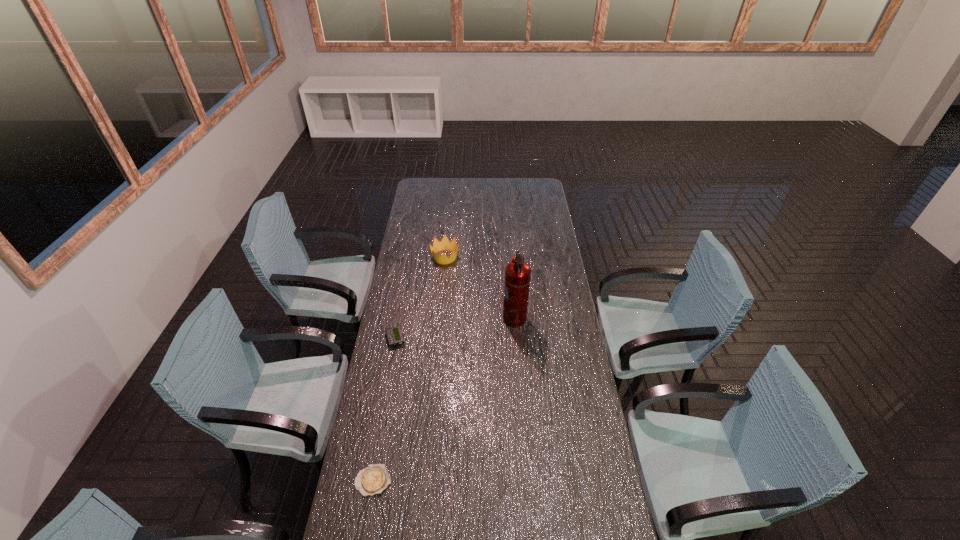
I want to click on vacant point located on the right of the second tallest object, so tap(503, 257).

This screenshot has width=960, height=540. I want to click on vacant region located on the right of the beeper, so click(446, 339).

This screenshot has width=960, height=540. What are the coordinates of `blank space located 0.050m on the front of the shortest object` in the screenshot? It's located at (368, 513).

Identify the location of beeper present at the left edge. (394, 335).

The width and height of the screenshot is (960, 540). I want to click on quiche at the left edge, so click(372, 480).

What are the coordinates of `blank space at the far edge of the desktop` in the screenshot? It's located at (443, 180).

Identify the location of vacant space at the left edge of the desktop. This screenshot has height=540, width=960. (380, 365).

In the image, there is a desktop. Identify the location of vacant space at the right edge. The width and height of the screenshot is (960, 540). (604, 526).

I want to click on unoccupied position between the farthest object and the beeper, so click(x=420, y=298).

At what (x,y) coordinates should I click in order to perform the action: click on free area in between the shortest object and the third shortest object. Please return your answer as a coordinate pair (x, y). Looking at the image, I should click on (409, 369).